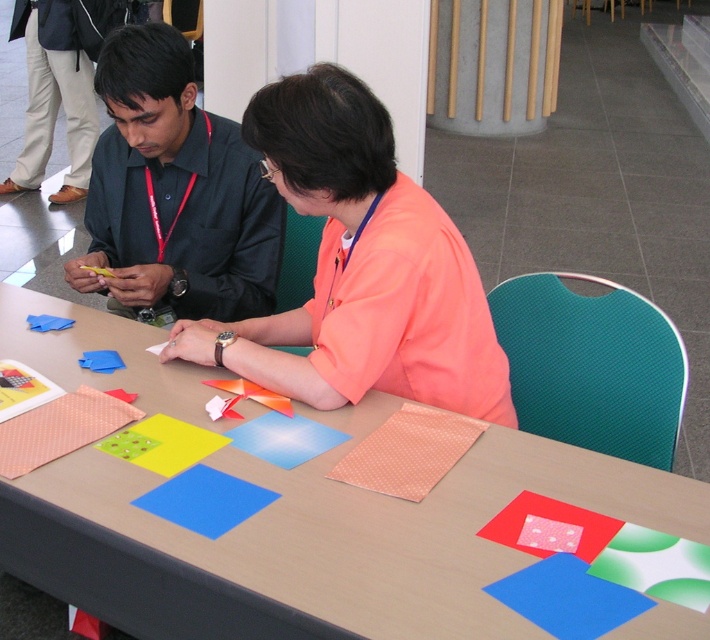
Who is higher up, orange matte shirt at center or matte black shirt at left?

matte black shirt at left is higher up.

Consider the image. Does orange matte shirt at center have a smaller size compared to matte black shirt at left?

No, orange matte shirt at center is not smaller than matte black shirt at left.

Is point (256, 378) positioned before point (102, 256)?

That is True.

Where is `orange matte shirt at center`? The width and height of the screenshot is (710, 640). orange matte shirt at center is located at coordinates pyautogui.click(x=360, y=268).

Can you confirm if smooth wooden table at center is shorter than matte black shirt at left?

No.

Describe the element at coordinates (383, 525) in the screenshot. I see `smooth wooden table at center` at that location.

Find the location of a particular element. The width and height of the screenshot is (710, 640). smooth wooden table at center is located at coordinates (383, 525).

Can you confirm if smooth wooden table at center is smaller than orange matte shirt at center?

Incorrect, smooth wooden table at center is not smaller in size than orange matte shirt at center.

Does smooth wooden table at center have a greater height compared to orange matte shirt at center?

Correct, smooth wooden table at center is much taller as orange matte shirt at center.

The height and width of the screenshot is (640, 710). Identify the location of smooth wooden table at center. (383, 525).